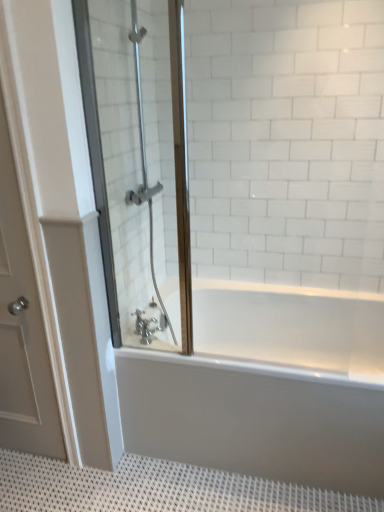
Question: Considering the relative sizes of white textured bath mat at lower center and white glossy bathtub at center in the image provided, is white textured bath mat at lower center thinner than white glossy bathtub at center?

Choices:
 (A) no
 (B) yes

Answer: (A)

Question: Is white textured bath mat at lower center placed right next to white glossy bathtub at center?

Choices:
 (A) no
 (B) yes

Answer: (A)

Question: Does white textured bath mat at lower center come behind white glossy bathtub at center?

Choices:
 (A) yes
 (B) no

Answer: (B)

Question: Can you confirm if white textured bath mat at lower center is bigger than white glossy bathtub at center?

Choices:
 (A) no
 (B) yes

Answer: (A)

Question: Can white glossy bathtub at center be found inside white textured bath mat at lower center?

Choices:
 (A) yes
 (B) no

Answer: (B)

Question: Is white textured bath mat at lower center to the left of white glossy bathtub at center from the viewer's perspective?

Choices:
 (A) yes
 (B) no

Answer: (A)

Question: Is white glossy bathtub at center smaller than white matte door at left?

Choices:
 (A) no
 (B) yes

Answer: (A)

Question: Does white glossy bathtub at center appear on the left side of white matte door at left?

Choices:
 (A) no
 (B) yes

Answer: (A)

Question: Is white glossy bathtub at center further to camera compared to white matte door at left?

Choices:
 (A) yes
 (B) no

Answer: (A)

Question: Considering the relative sizes of white glossy bathtub at center and white matte door at left in the image provided, is white glossy bathtub at center wider than white matte door at left?

Choices:
 (A) no
 (B) yes

Answer: (B)

Question: Can you confirm if white glossy bathtub at center is bigger than white matte door at left?

Choices:
 (A) yes
 (B) no

Answer: (A)

Question: Is white glossy bathtub at center thinner than white matte door at left?

Choices:
 (A) yes
 (B) no

Answer: (B)

Question: Is white glossy bathtub at center positioned beyond the bounds of white textured bath mat at lower center?

Choices:
 (A) no
 (B) yes

Answer: (B)